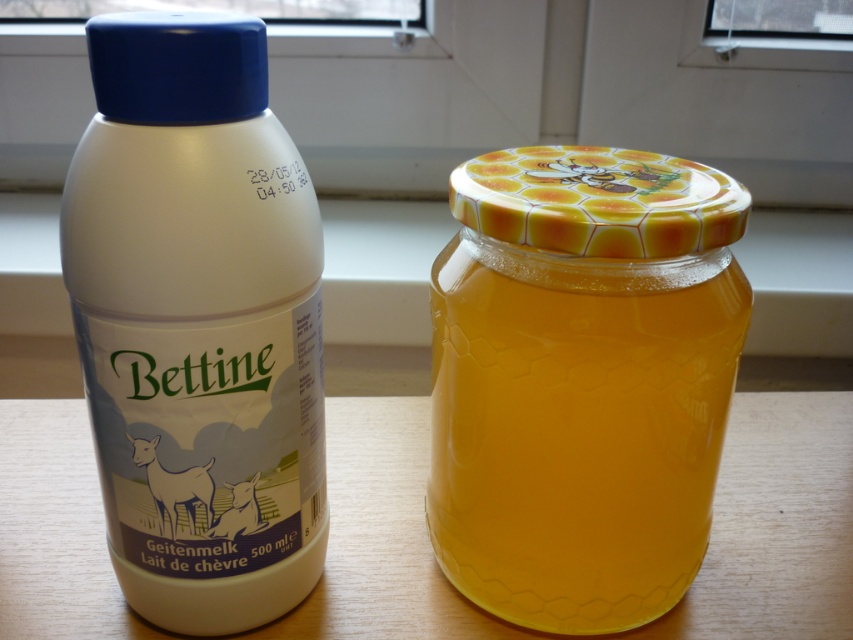
Question: Based on their relative distances, which object is nearer to the white matte plastic bottle at center?

Choices:
 (A) wooden table at center
 (B) translucent yellow honey at center

Answer: (B)

Question: Is translucent yellow honey at center smaller than wooden table at center?

Choices:
 (A) no
 (B) yes

Answer: (B)

Question: Can you confirm if translucent yellow honey at center is smaller than wooden table at center?

Choices:
 (A) yes
 (B) no

Answer: (A)

Question: Can you confirm if white matte plastic bottle at center is positioned above translucent yellow honey at center?

Choices:
 (A) yes
 (B) no

Answer: (A)

Question: Which point is farther from the camera taking this photo?

Choices:
 (A) (61, 474)
 (B) (115, 230)

Answer: (A)

Question: Among these objects, which one is farthest from the camera?

Choices:
 (A) white matte plastic bottle at center
 (B) translucent yellow honey at center

Answer: (B)